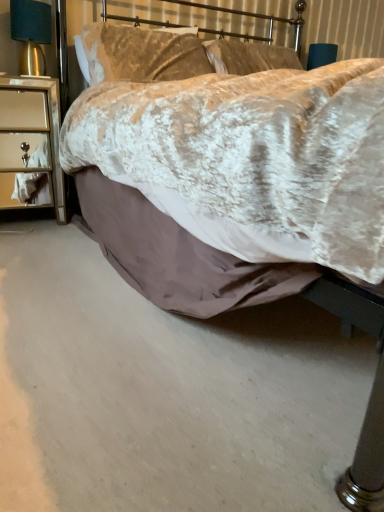
Question: Is velvet beige pillow at upper center further to camera compared to silver mirrored nightstand at left?

Choices:
 (A) no
 (B) yes

Answer: (B)

Question: From a real-world perspective, is velvet beige pillow at upper center physically above silver mirrored nightstand at left?

Choices:
 (A) yes
 (B) no

Answer: (A)

Question: Considering the relative positions of velvet beige pillow at upper center and silver mirrored nightstand at left in the image provided, is velvet beige pillow at upper center to the right of silver mirrored nightstand at left from the viewer's perspective?

Choices:
 (A) no
 (B) yes

Answer: (B)

Question: From a real-world perspective, is velvet beige pillow at upper center below silver mirrored nightstand at left?

Choices:
 (A) no
 (B) yes

Answer: (A)

Question: From the image's perspective, is velvet beige pillow at upper center on top of silver mirrored nightstand at left?

Choices:
 (A) yes
 (B) no

Answer: (A)

Question: Relative to silver mirrored nightstand at left, is satin gold lampshade at left in front or behind?

Choices:
 (A) front
 (B) behind

Answer: (B)

Question: Considering the positions of point (36, 50) and point (61, 185), is point (36, 50) closer or farther from the camera than point (61, 185)?

Choices:
 (A) farther
 (B) closer

Answer: (B)

Question: Visually, is satin gold lampshade at left positioned to the left or to the right of silver mirrored nightstand at left?

Choices:
 (A) left
 (B) right

Answer: (B)

Question: Is satin gold lampshade at left bigger or smaller than silver mirrored nightstand at left?

Choices:
 (A) big
 (B) small

Answer: (B)

Question: Is point (41, 130) positioned closer to the camera than point (16, 30)?

Choices:
 (A) farther
 (B) closer

Answer: (A)

Question: Is silver mirrored nightstand at left taller or shorter than satin gold lampshade at left?

Choices:
 (A) tall
 (B) short

Answer: (A)

Question: Is silver mirrored nightstand at left wider or thinner than satin gold lampshade at left?

Choices:
 (A) wide
 (B) thin

Answer: (A)

Question: Is silver mirrored nightstand at left to the left or to the right of satin gold lampshade at left in the image?

Choices:
 (A) left
 (B) right

Answer: (A)

Question: From the image's perspective, relative to velvet beige pillow at upper center, is satin gold lampshade at left above or below?

Choices:
 (A) below
 (B) above

Answer: (A)

Question: Looking at their shapes, would you say satin gold lampshade at left is wider or thinner than velvet beige pillow at upper center?

Choices:
 (A) thin
 (B) wide

Answer: (A)